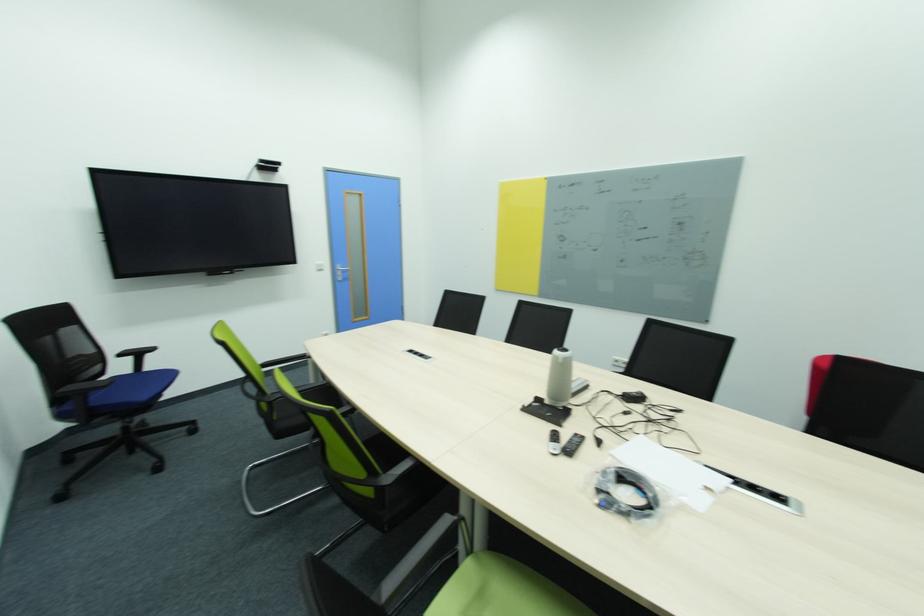
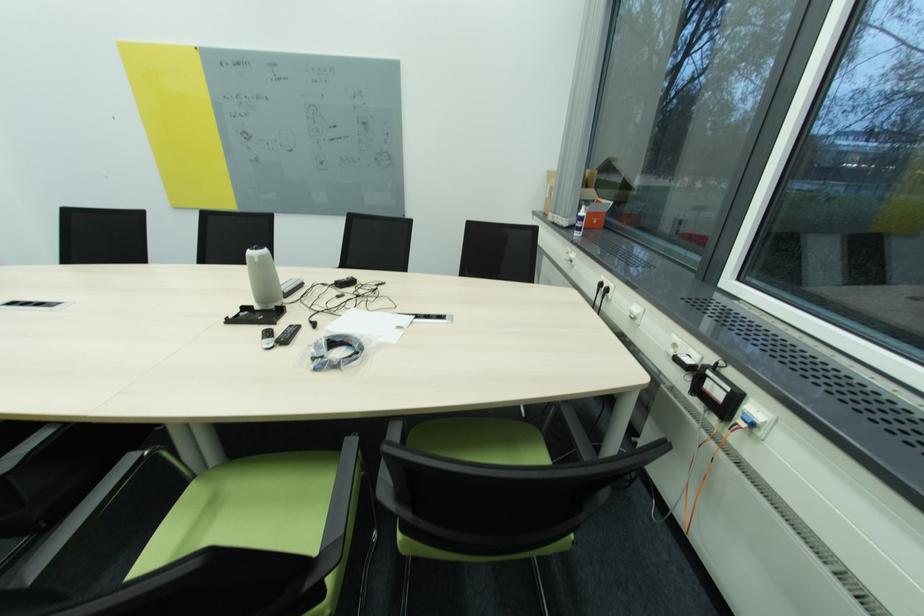
Question: I am providing you with two images of the same scene from different viewpoints. After the viewpoint changes to image2, which objects are now occluded?

Choices:
 (A) green chair sitting surface
 (B) white spray bottle
 (C) white power socket
 (D) none of these

Answer: (D)